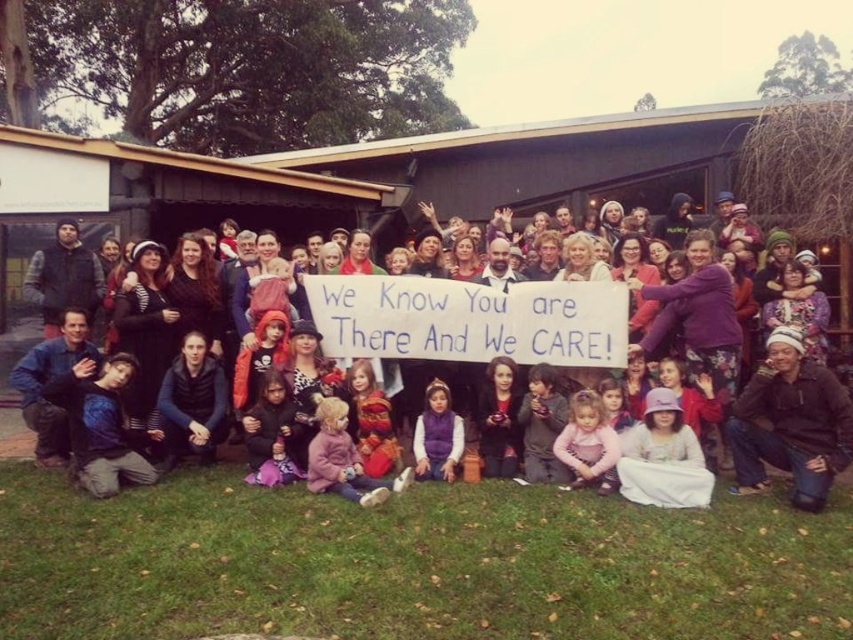
You are standing at the point marked by the coordinate point [437,435] in the image. What object is located at this point?

The point [437,435] marks the purple fleece vest at center.

You are standing in the middle of the group and want to find the purple fleece vest at center. According to the coordinates provided, in which direction should you look to locate it?

The purple fleece vest at center is located at coordinates point (437, 435). Since the coordinate system is not specified, but assuming standard image coordinates where x increases to the right and y increases downward, the vest is positioned to the right and slightly below the center point of the image. Therefore, you should look towards the lower right direction from the center to find it.

You are a photographer standing at the edge of the grassy area where the children are sitting. You want to take a photo that includes both the purple fleece vest at center and the signboard on the building. Since the signboard is behind the group, will you need to move closer or farther away to ensure both are in frame?

Since the purple fleece vest at center and the signboard are 6.27 meters apart, you would need to move farther away to ensure both are in frame.